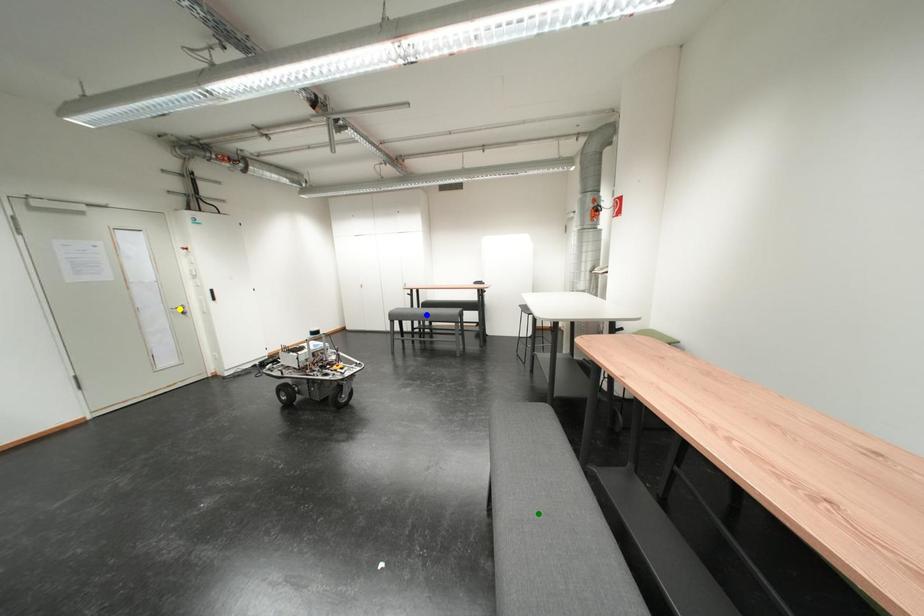
Order these from nearest to farthest:
A) green point
B) yellow point
C) blue point

1. green point
2. yellow point
3. blue point